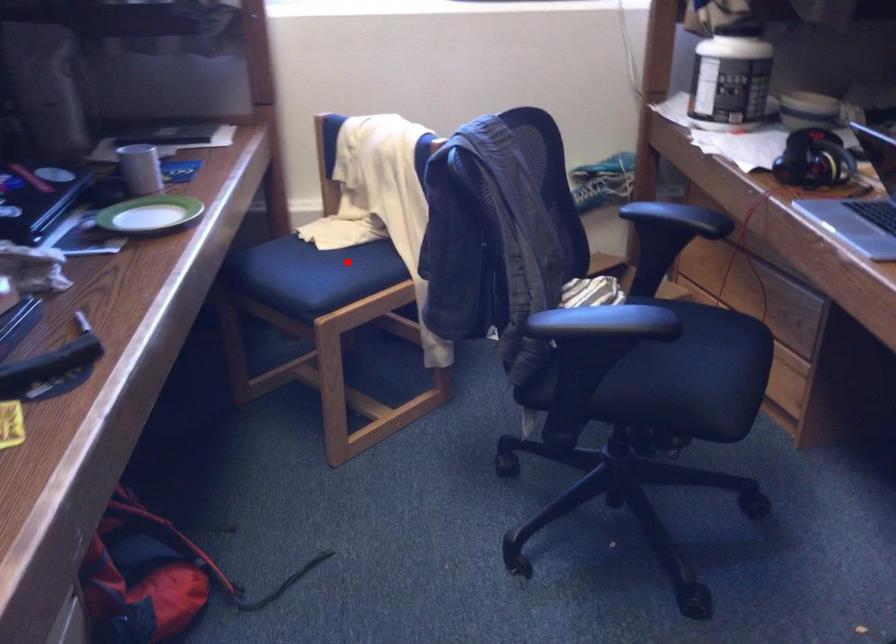
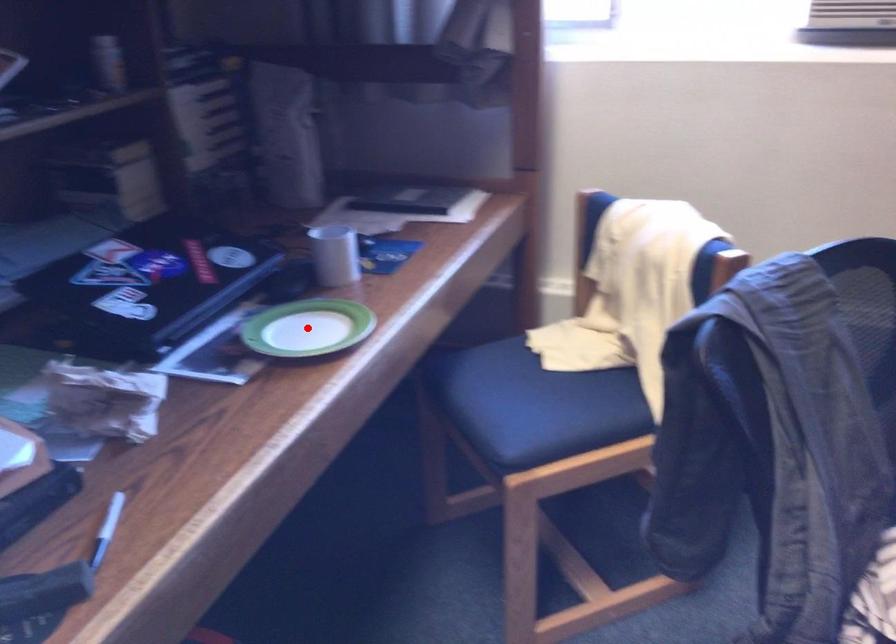
I am providing you with two images of the same scene from different viewpoints. A red point is marked on the first image and another point is marked on the second image. Is the marked point in image1 the same physical position as the marked point in image2?

No